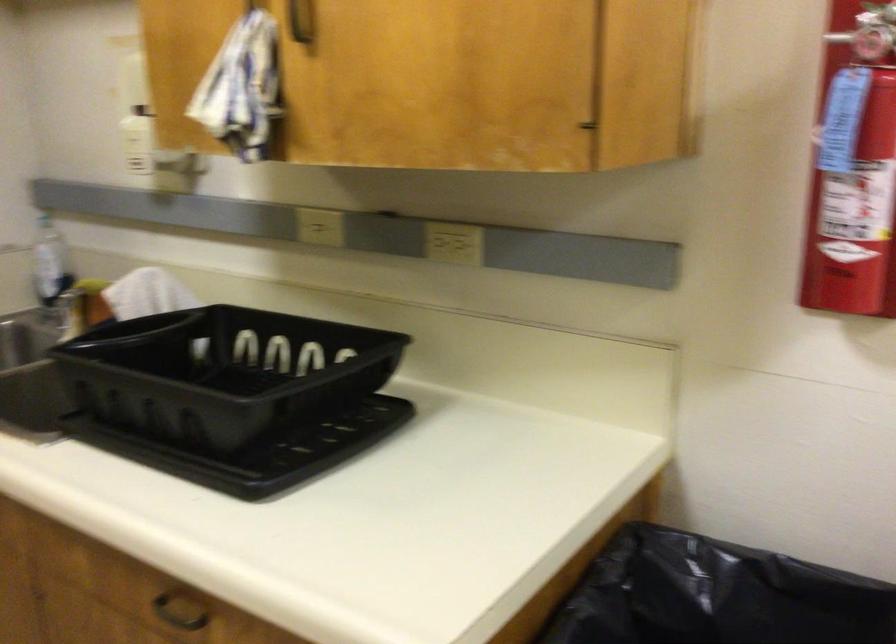
Where would you pull the fire extinguisher pin? Please return your answer as a coordinate pair (x, y).

(872, 49)